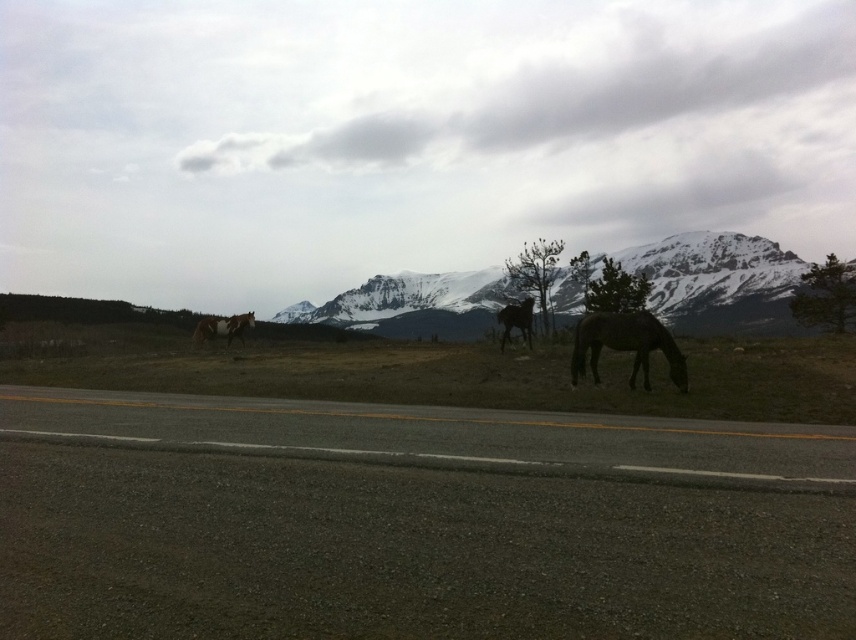
Which is above, asphalt road at center or green grass at center?

green grass at center is higher up.

Is asphalt road at center positioned in front of green grass at center?

Yes.

Is point (639, 508) positioned behind point (373, 396)?

That is False.

Identify the location of asphalt road at center. pyautogui.click(x=414, y=522).

Does green grass at center have a greater width compared to snowy granite mountain at center?

No, green grass at center is not wider than snowy granite mountain at center.

Which is below, green grass at center or snowy granite mountain at center?

green grass at center is lower down.

Image resolution: width=856 pixels, height=640 pixels. I want to click on green grass at center, so click(450, 372).

Where is `snowy granite mountain at center`? snowy granite mountain at center is located at coordinates (717, 280).

Who is more distant from viewer, (306,310) or (253,316)?

The point (306,310) is behind.

You are a GUI agent. You are given a task and a screenshot of the screen. Output one action in this format:
    pyautogui.click(x=<x>, y=<y>)
    Task: Click on the snowy granite mountain at center
    The height and width of the screenshot is (640, 856).
    Given the screenshot: What is the action you would take?
    pyautogui.click(x=717, y=280)